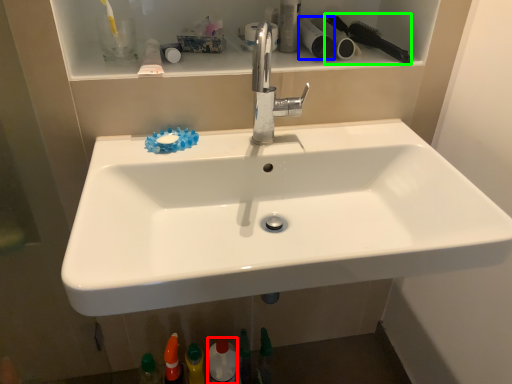
Question: Which object is positioned farthest from mouthwash (highlighted by a red box)? Select from toilet paper (highlighted by a blue box) and brush (highlighted by a green box).

Choices:
 (A) toilet paper
 (B) brush

Answer: (B)